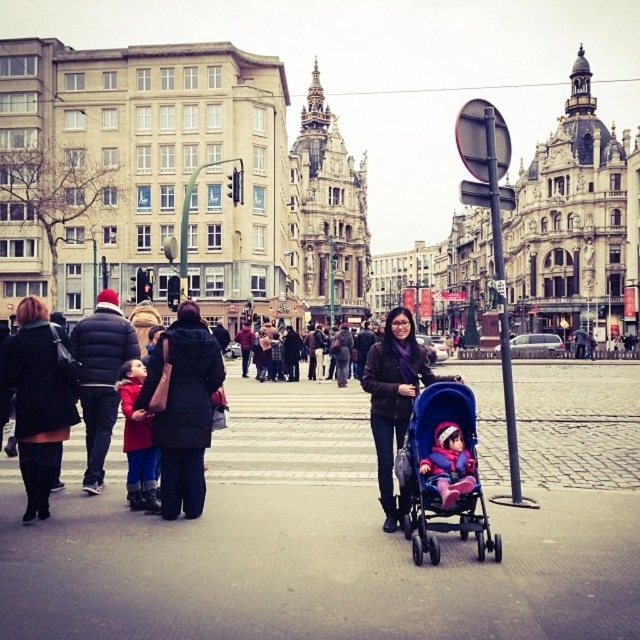
You are standing at the point marked by the coordinates point (138, 440) in the image. What object is located at that point?

The point (138, 440) corresponds to the matte red coat at left.

Based on the photo, you are a delivery person in the city and need to navigate around the matte pink fabric baby carriage at center. What are the coordinates of the baby carriage to avoid it?

The coordinates of the matte pink fabric baby carriage at center are at point (449, 465).

You are standing in the middle of the street in the urban scene. There are two points marked on the ground in front of you. The first point is at coordinates point (x=136, y=428) and the second point is at coordinates point (x=314, y=356). Which point is closer to you?

Point (x=136, y=428) is closer to the viewer than point (x=314, y=356).